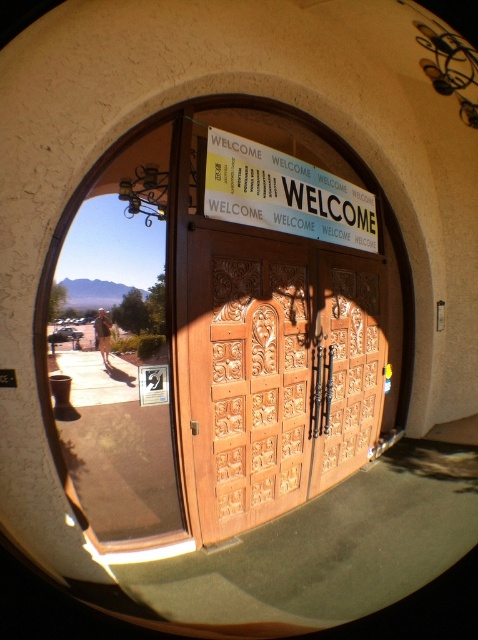
Consider the image. You are a guest arriving at the entrance and want to read the yellow paper sign at center. Which direction should you look relative to the wooden carved doors at center?

The yellow paper sign at center is above the wooden carved doors at center, so you should look upward from the wooden carved doors at center to see the yellow paper sign at center.

You are a delivery person trying to deliver a package to the address displayed on the yellow paper sign at center. You need to know if the wooden carved doors at center are wide enough for your 2.5 meter wide truck to pass through. Can you determine this based on the information provided?

The wooden carved doors at center might be wider than yellow paper sign at center, but since the exact width of the doors isn not provided, it is uncertain whether they are wide enough for the 2.5 meter wide truck to pass through.